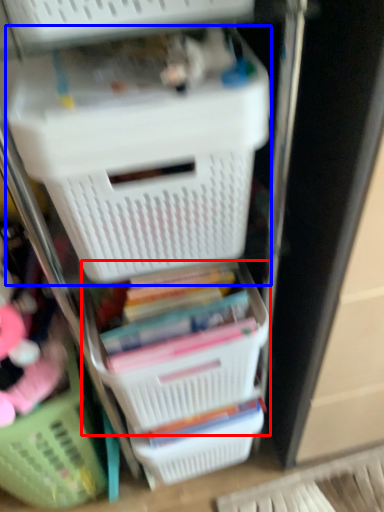
Question: Among these objects, which one is farthest to the camera, basket (highlighted by a red box) or storage box (highlighted by a blue box)?

Choices:
 (A) basket
 (B) storage box

Answer: (A)